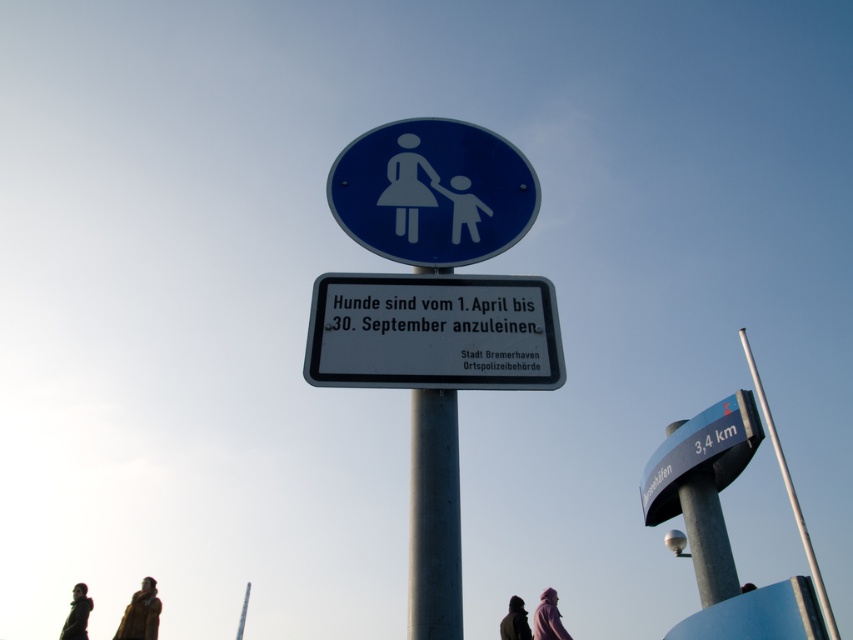
Question: Does white plastic sign at center have a smaller size compared to purple fabric at lower center?

Choices:
 (A) yes
 (B) no

Answer: (A)

Question: Is metallic silver signpost at right positioned before silver metallic pole at upper right?

Choices:
 (A) yes
 (B) no

Answer: (B)

Question: Does white plastic sign at center lie behind dark green jacket at lower left?

Choices:
 (A) yes
 (B) no

Answer: (B)

Question: Which of the following is the farthest from the observer?

Choices:
 (A) (543, 598)
 (B) (645, 465)
 (C) (433, 406)
 (D) (65, 628)

Answer: (B)

Question: Which object is closer to the camera taking this photo?

Choices:
 (A) dark brown leather jacket at lower left
 (B) metallic silver signpost at right
 (C) blue plastic sign at upper center
 (D) dark brown fur coat at lower center

Answer: (C)

Question: Which of these objects is positioned closest to the blue plastic sign at upper center?

Choices:
 (A) silver metallic pole at upper right
 (B) dark brown fur coat at lower center
 (C) dark green jacket at lower left
 (D) silver metallic pole at center

Answer: (D)